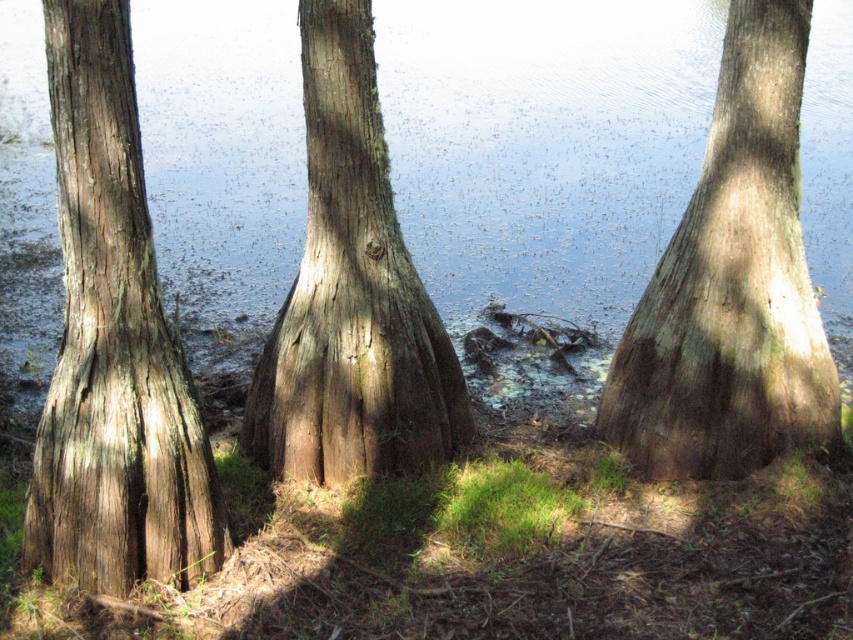
You are standing in a natural area with three cypress trees. You notice a specific point marked at coordinates point (54, 541). If you want to reach this point, how far will you have to walk from your current position?

The distance of point (54, 541) from viewer is 3.85 meters, so you will have to walk 3.85 meters to reach it.

You are standing in front of the three cypress trees and want to find the clear water at center. According to the coordinates provided, where exactly should you look relative to the trees?

The clear water at center is located at coordinates point [543,145], which means it is positioned to the lower left of the trees.

You are standing in a forest and want to measure the distance to the smooth brown tree trunk at left. If your measuring tape can only extend 3 meters, will it reach the tree trunk?

The smooth brown tree trunk at left is 3.28 meters away from the viewer, so the measuring tape that can only extend 3 meters will not reach the tree trunk.